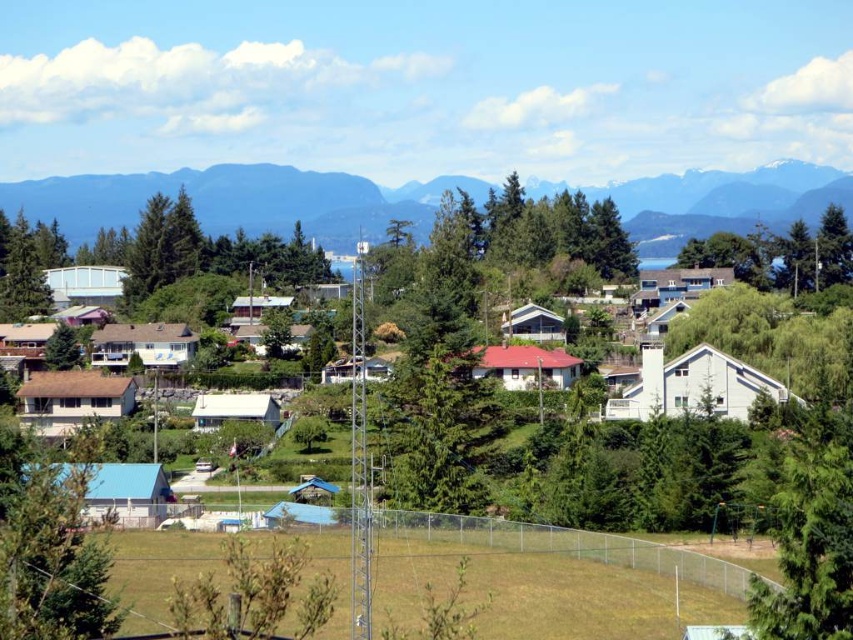
Question: Is green forested mountain at upper center positioned before green leafy tree at lower left?

Choices:
 (A) yes
 (B) no

Answer: (B)

Question: Which point appears closest to the camera in this image?

Choices:
 (A) (289, 180)
 (B) (4, 580)

Answer: (B)

Question: Does green forested mountain at upper center appear on the left side of green leafy tree at lower left?

Choices:
 (A) yes
 (B) no

Answer: (B)

Question: Is green forested mountain at upper center positioned in front of green leafy tree at lower left?

Choices:
 (A) yes
 (B) no

Answer: (B)